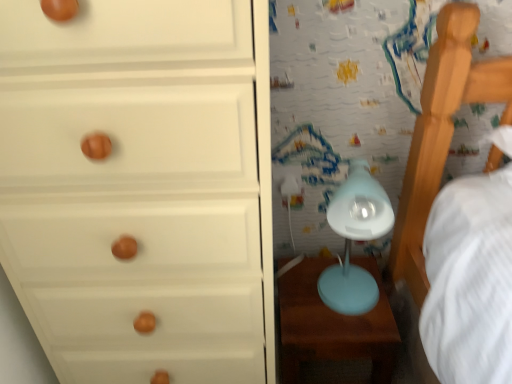
Where is `empty space that is ontop of matte blue table at lower right (from a real-world perspective)`? empty space that is ontop of matte blue table at lower right (from a real-world perspective) is located at coordinates (330, 296).